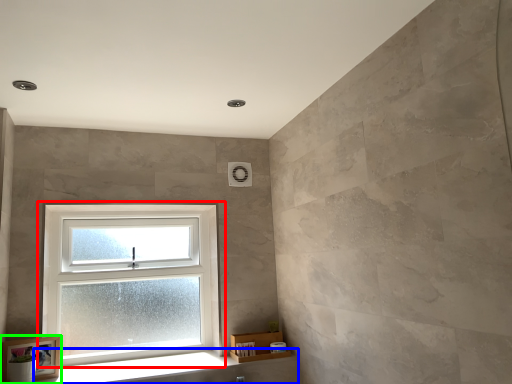
Question: Which is farther away from window (highlighted by a red box)? window sill (highlighted by a blue box) or picture frame (highlighted by a green box)?

Choices:
 (A) window sill
 (B) picture frame

Answer: (B)